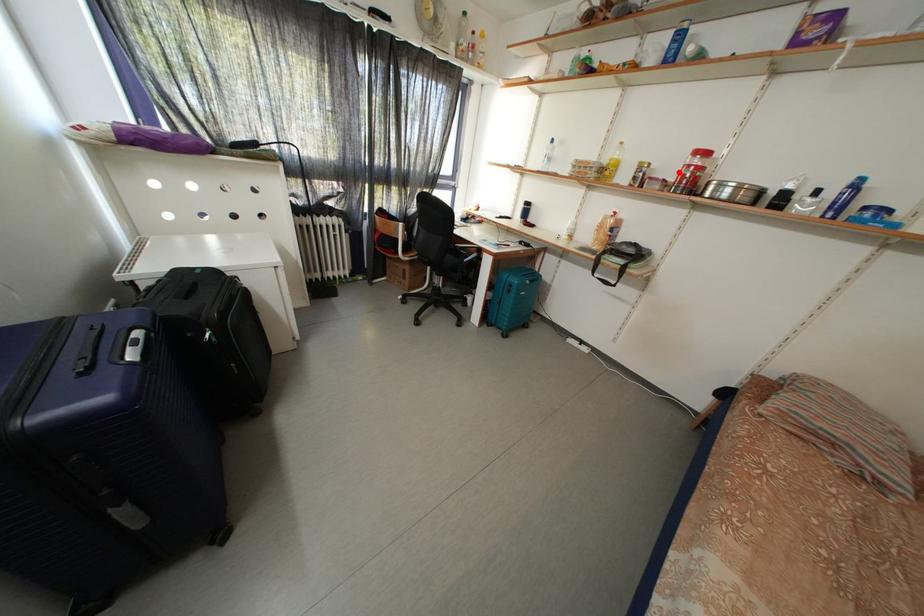
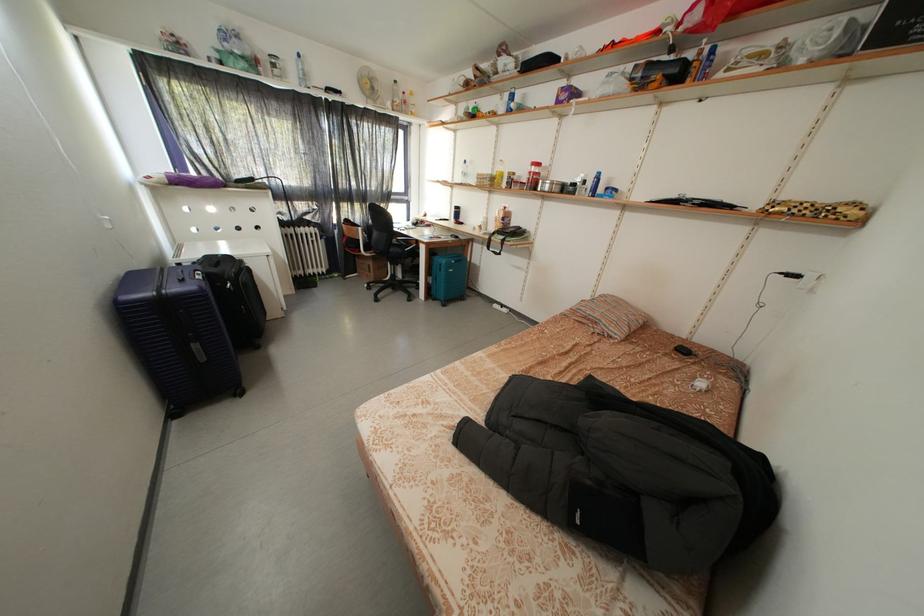
Question: I am providing you with two images of the same scene from different viewpoints. A red point is shown in image1. For the corresponding object point in image2, is it positioned nearer or farther from the camera?

Choices:
 (A) Nearer
 (B) Farther

Answer: (A)